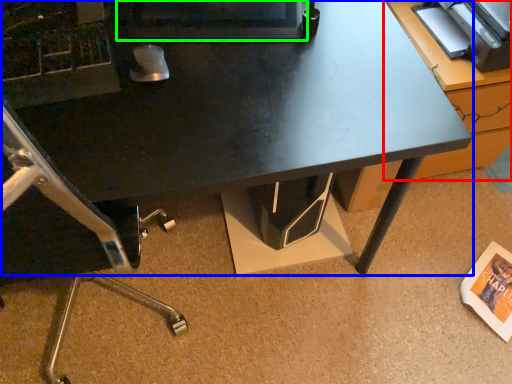
Question: Estimate the real-world distances between objects in this image. Which object is farther from table (highlighted by a red box), desk (highlighted by a blue box) or computer monitor (highlighted by a green box)?

Choices:
 (A) desk
 (B) computer monitor

Answer: (B)